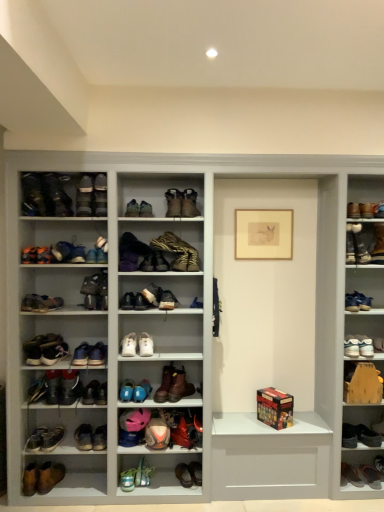
In order to click on free space in front of green suede sneakers at lower center, which ranks as the 14th footwear in left-to-right order in this screenshot , I will do `click(150, 494)`.